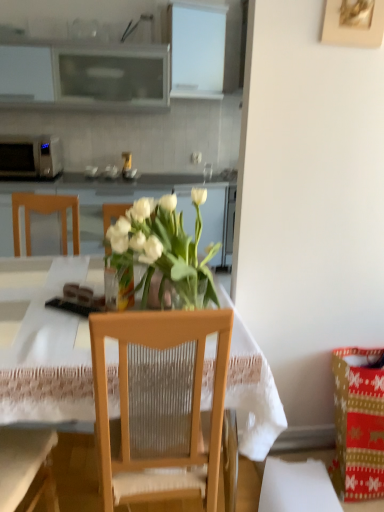
Question: Considering the relative sizes of matte glass coffee cup at center and white glossy cabinet at center in the image provided, is matte glass coffee cup at center taller than white glossy cabinet at center?

Choices:
 (A) no
 (B) yes

Answer: (A)

Question: Is matte glass coffee cup at center positioned with its back to white glossy cabinet at center?

Choices:
 (A) yes
 (B) no

Answer: (B)

Question: From a real-world perspective, is matte glass coffee cup at center over white glossy cabinet at center?

Choices:
 (A) no
 (B) yes

Answer: (B)

Question: From the image's perspective, is matte glass coffee cup at center under white glossy cabinet at center?

Choices:
 (A) yes
 (B) no

Answer: (B)

Question: Is matte glass coffee cup at center positioned before white glossy cabinet at center?

Choices:
 (A) yes
 (B) no

Answer: (B)

Question: Does matte glass coffee cup at center appear on the right side of white glossy cabinet at center?

Choices:
 (A) yes
 (B) no

Answer: (A)

Question: Could white glossy cabinet at center be considered to be inside transparent glass vase at center?

Choices:
 (A) no
 (B) yes

Answer: (A)

Question: Are transparent glass vase at center and white glossy cabinet at center far apart?

Choices:
 (A) yes
 (B) no

Answer: (A)

Question: From a real-world perspective, does transparent glass vase at center stand above white glossy cabinet at center?

Choices:
 (A) no
 (B) yes

Answer: (A)

Question: Does transparent glass vase at center have a greater width compared to white glossy cabinet at center?

Choices:
 (A) no
 (B) yes

Answer: (B)

Question: Is transparent glass vase at center smaller than white glossy cabinet at center?

Choices:
 (A) yes
 (B) no

Answer: (A)

Question: Considering the relative positions of transparent glass vase at center and white glossy cabinet at center in the image provided, is transparent glass vase at center to the right of white glossy cabinet at center from the viewer's perspective?

Choices:
 (A) no
 (B) yes

Answer: (B)

Question: From a real-world perspective, is matte glass coffee cup at center positioned over clear glass vase at center based on gravity?

Choices:
 (A) no
 (B) yes

Answer: (B)